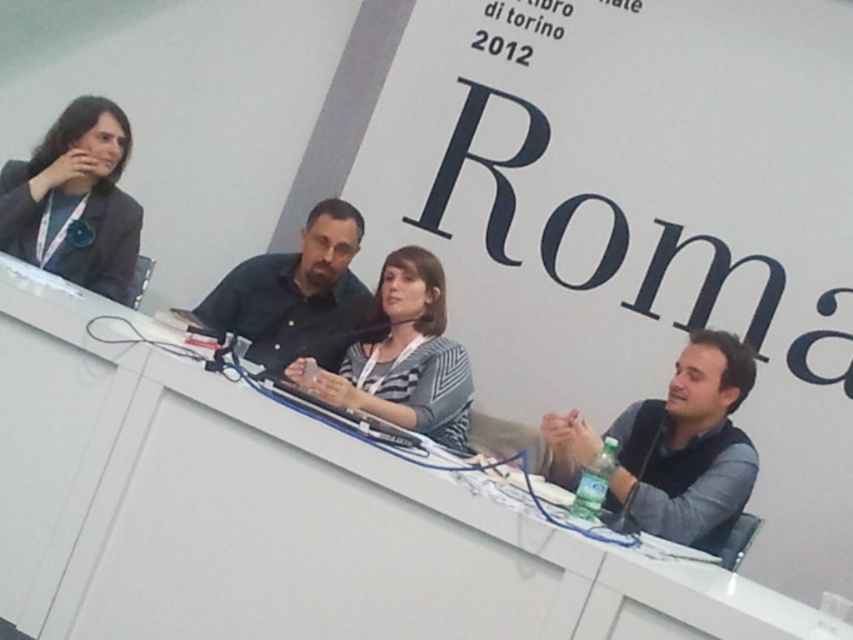
Question: Among these objects, which one is farthest from the camera?

Choices:
 (A) matte black jacket at upper left
 (B) gray fabric vest at right
 (C) black shirt at center

Answer: (A)

Question: Is white plastic table at center below striped fabric shirt at center?

Choices:
 (A) yes
 (B) no

Answer: (A)

Question: Which object is closer to the camera taking this photo?

Choices:
 (A) striped fabric shirt at center
 (B) gray fabric vest at right
 (C) white plastic table at center
 (D) matte black jacket at upper left

Answer: (C)

Question: Which object is closer to the camera taking this photo?

Choices:
 (A) matte black jacket at upper left
 (B) striped fabric shirt at center

Answer: (B)

Question: Does matte black jacket at upper left appear on the left side of black shirt at center?

Choices:
 (A) yes
 (B) no

Answer: (A)

Question: Does matte black jacket at upper left appear over striped fabric shirt at center?

Choices:
 (A) no
 (B) yes

Answer: (B)